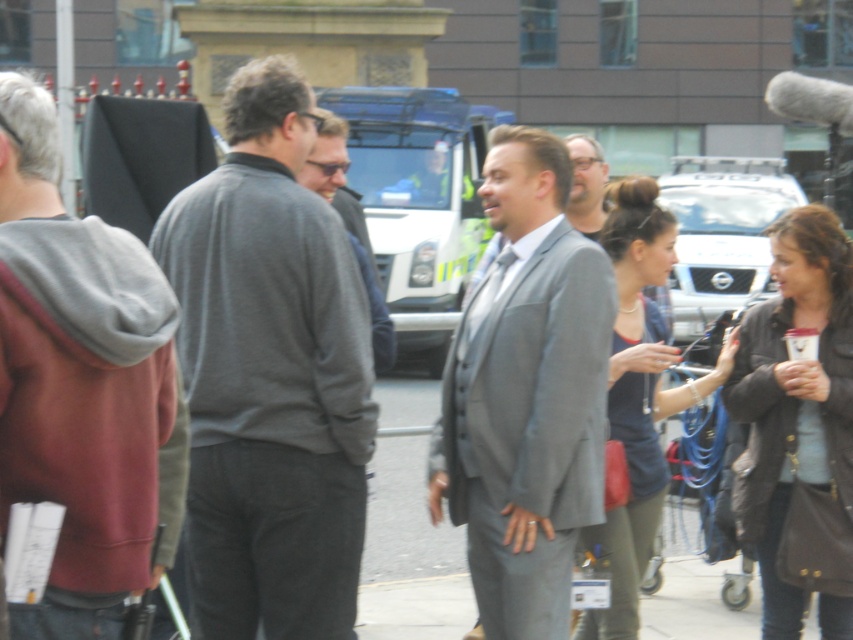
Question: Is gray hoodie at left smaller than matte blue top at center?

Choices:
 (A) yes
 (B) no

Answer: (A)

Question: Is dark gray sweater at center above matte blue top at center?

Choices:
 (A) yes
 (B) no

Answer: (A)

Question: Which point is farther to the camera?

Choices:
 (A) (231, 529)
 (B) (585, 464)

Answer: (A)

Question: Which object is farther from the camera taking this photo?

Choices:
 (A) gray hoodie at left
 (B) brown leather jacket at center
 (C) dark gray sweater at center
 (D) matte blue top at center

Answer: (B)

Question: Which of the following is the farthest from the observer?

Choices:
 (A) (99, 579)
 (B) (613, 378)
 (C) (486, 600)
 (D) (843, 620)

Answer: (B)

Question: Does brown leather jacket at center have a lesser width compared to matte blue top at center?

Choices:
 (A) no
 (B) yes

Answer: (B)